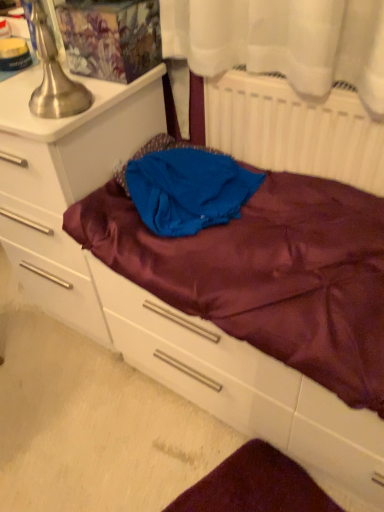
Locate an element on the screen. vacant space situated on the left part of brushed metal table lamp at upper left is located at coordinates (14, 109).